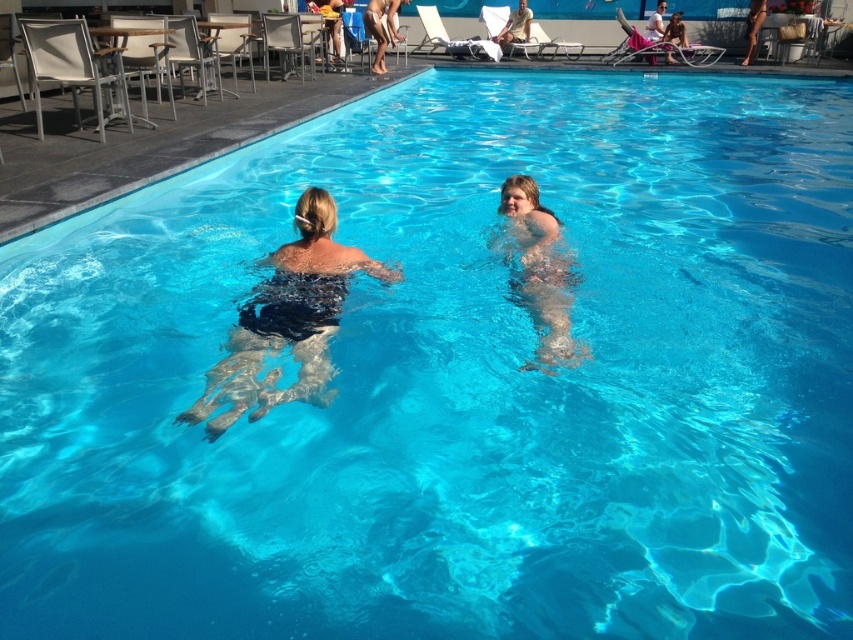
Question: Is smooth skin at center positioned in front of smooth skin child at center?

Choices:
 (A) no
 (B) yes

Answer: (B)

Question: Which point is farther to the camera?

Choices:
 (A) smooth skin at center
 (B) smooth skin child at center

Answer: (B)

Question: Which point is closer to the camera taking this photo?

Choices:
 (A) (553, 252)
 (B) (519, 16)
 (C) (339, 296)

Answer: (C)

Question: Is smooth skin at center in front of smooth skin child at center?

Choices:
 (A) yes
 (B) no

Answer: (A)

Question: Which of the following is the farthest from the observer?

Choices:
 (A) (523, 282)
 (B) (210, 435)

Answer: (A)

Question: Where is smooth skin at center located in relation to smooth skin child at center in the image?

Choices:
 (A) left
 (B) right

Answer: (A)